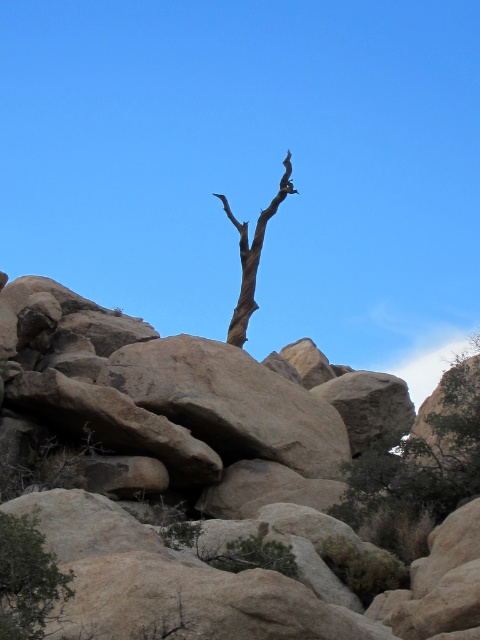
Question: Observing the image, what is the correct spatial positioning of green leafy shrub at lower left in reference to brown bark tree at center?

Choices:
 (A) right
 (B) left

Answer: (B)

Question: Which of these objects is positioned closest to the brown rough rock at upper center?

Choices:
 (A) green leafy shrub at lower left
 (B) brown bark tree at center

Answer: (A)

Question: Based on their relative distances, which object is nearer to the green leafy shrub at lower left?

Choices:
 (A) brown bark tree at center
 (B) green leafy tree at right

Answer: (B)

Question: Can you confirm if brown rough rock at upper center is positioned above brown bark tree at center?

Choices:
 (A) no
 (B) yes

Answer: (A)

Question: Does brown rough rock at upper center appear on the left side of brown bark tree at center?

Choices:
 (A) yes
 (B) no

Answer: (A)

Question: Which object is the closest to the brown bark tree at center?

Choices:
 (A) brown rough rock at upper center
 (B) green leafy shrub at lower left

Answer: (A)